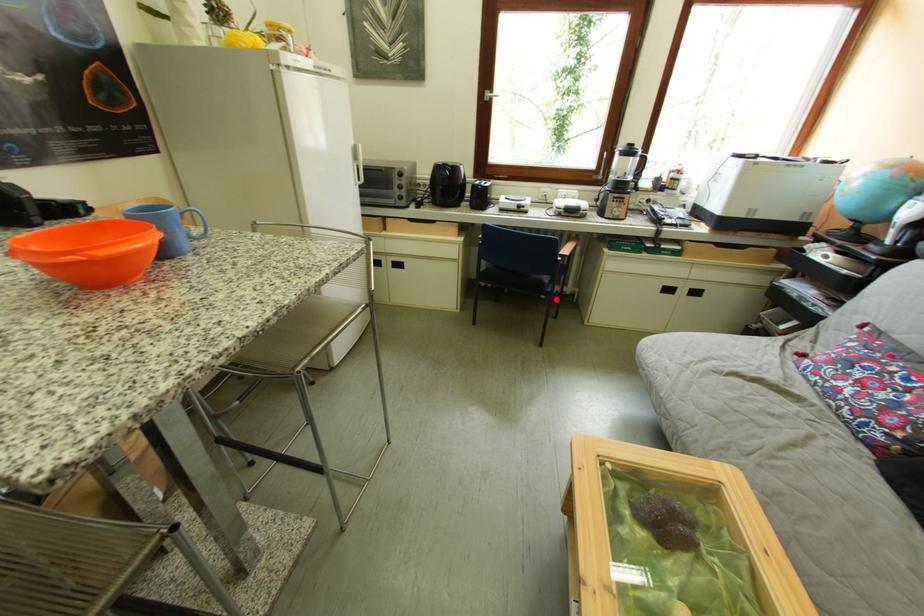
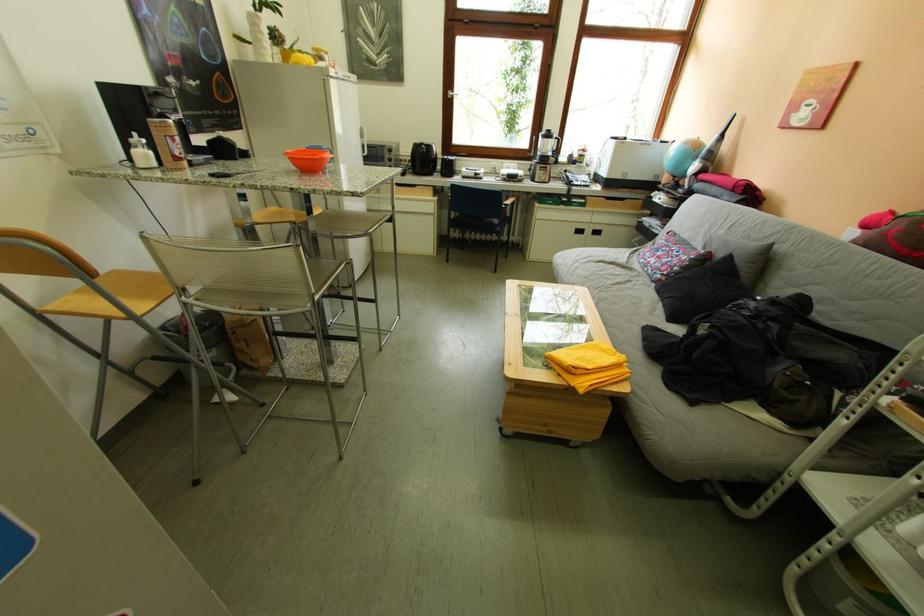
Question: I am providing you with two images of the same scene from different viewpoints. Image1 has a red point marked. In image2, the corresponding 3D location appears at what relative position? Reply with the corresponding letter.

Choices:
 (A) Closer
 (B) Farther

Answer: (A)